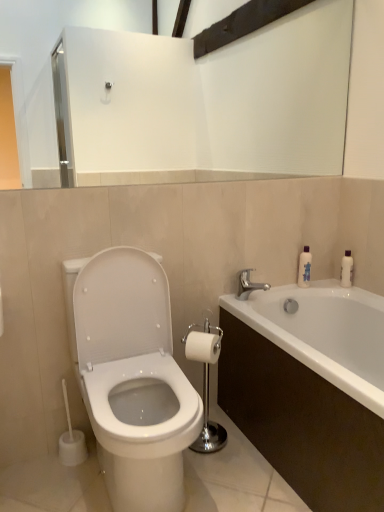
Question: Relative to translucent plastic bottle at upper right, is silver metallic faucet at upper right in front or behind?

Choices:
 (A) front
 (B) behind

Answer: (A)

Question: From the image's perspective, relative to translucent plastic bottle at upper right, is silver metallic faucet at upper right above or below?

Choices:
 (A) below
 (B) above

Answer: (A)

Question: Based on their relative distances, which object is farther from the white matte toilet paper at center?

Choices:
 (A) polished chrome toilet paper holder at center
 (B) white glossy toilet at left
 (C) translucent plastic bottle at upper right
 (D) silver metallic faucet at upper right
 (E) white glossy bathtub at lower right

Answer: (C)

Question: Estimate the real-world distances between objects in this image. Which object is closer to the white glossy toilet at left?

Choices:
 (A) silver metallic faucet at upper right
 (B) polished chrome toilet paper holder at center
 (C) white glossy bathtub at lower right
 (D) white matte toilet paper at center
 (E) translucent plastic bottle at upper right

Answer: (D)